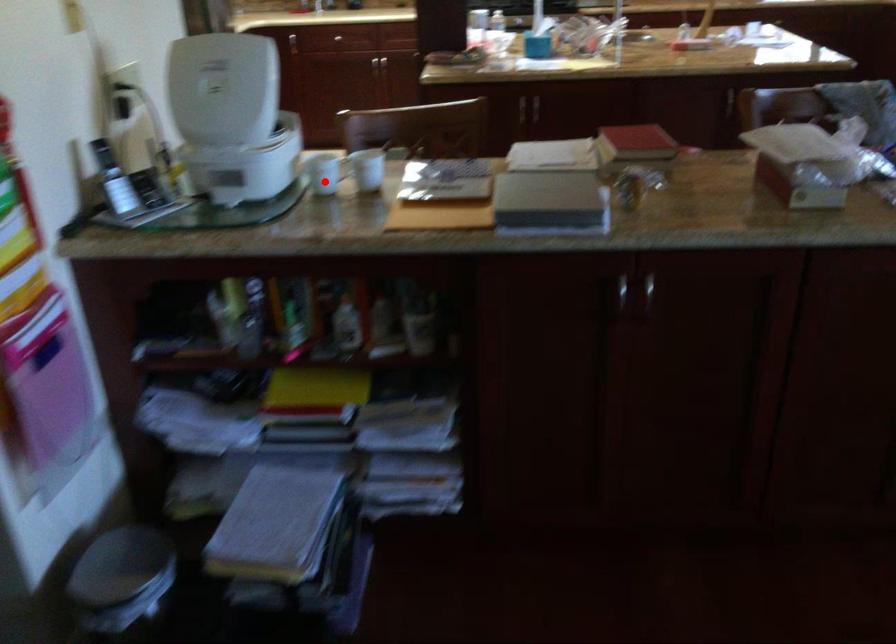
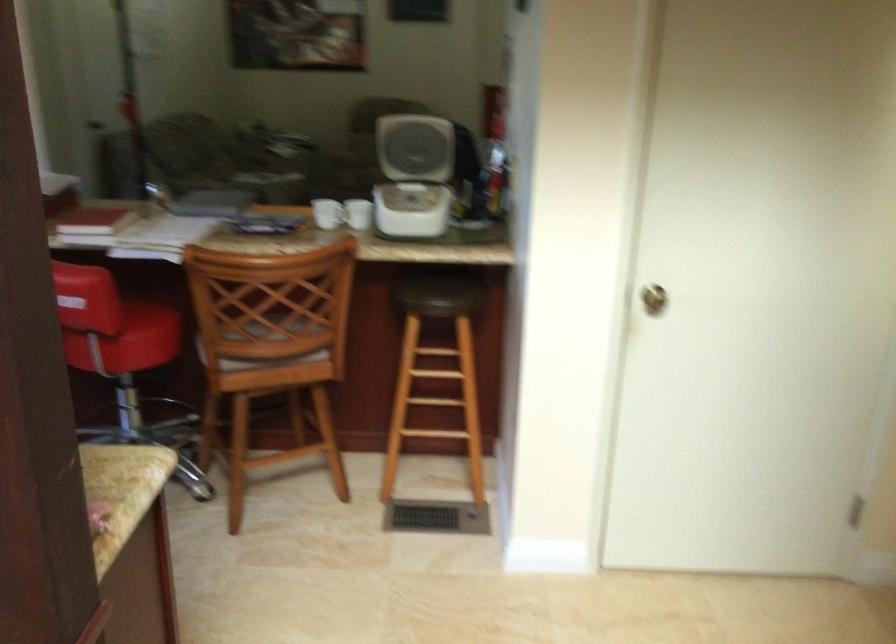
In the second image, find the point that corresponds to the highlighted location in the first image.

(358, 214)